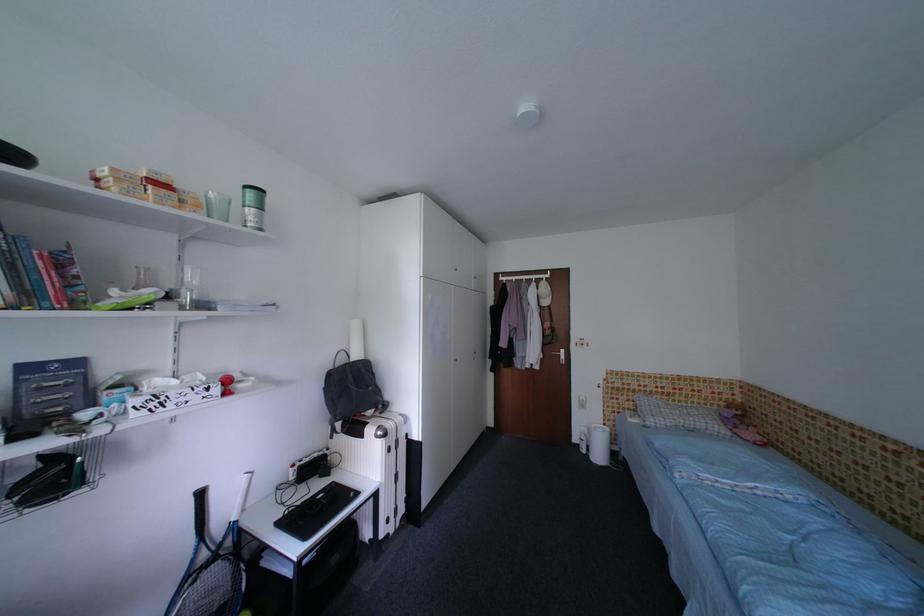
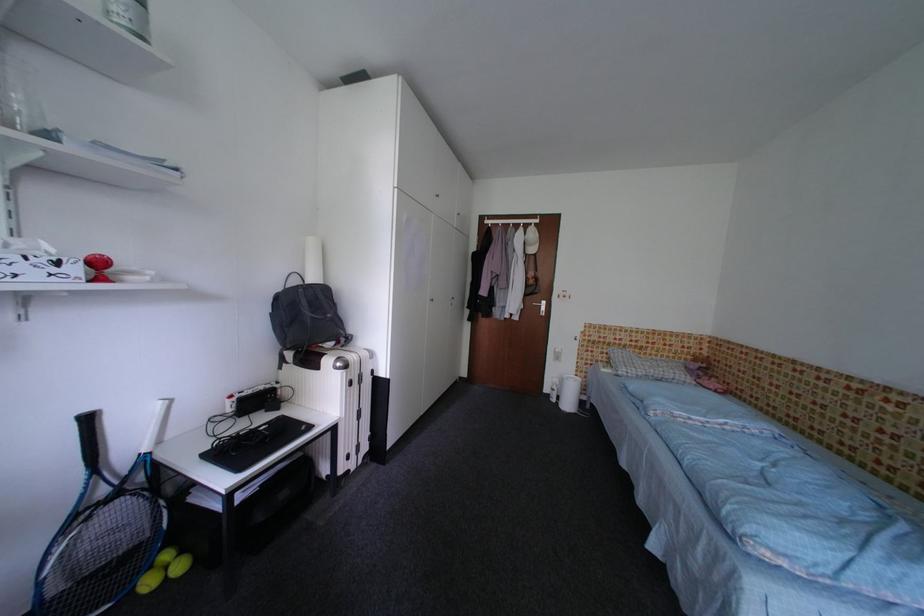
In the second image, find the point that corresponds to (x=554, y=349) in the first image.

(536, 300)